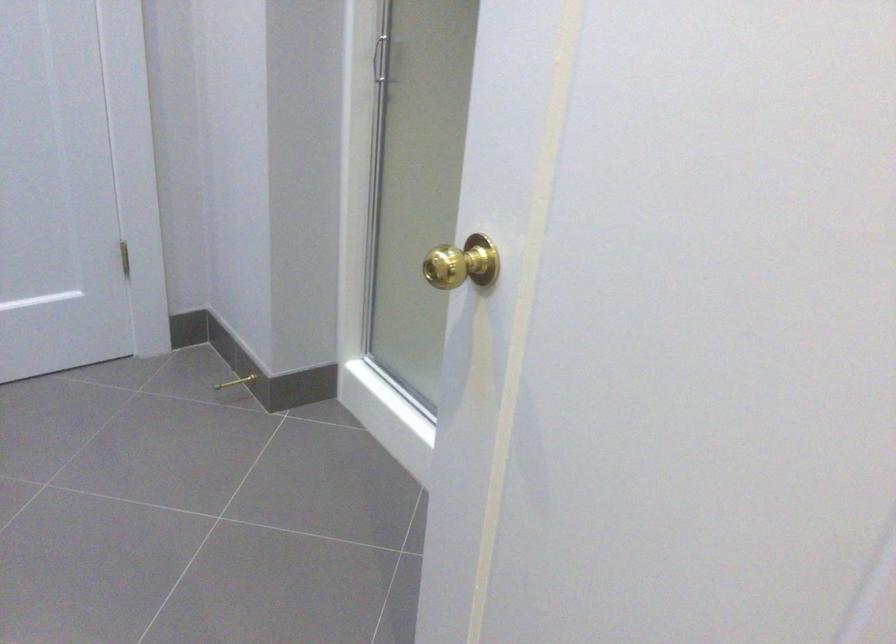
The location [235,382] corresponds to which object?

It corresponds to the brass door stop in the image.